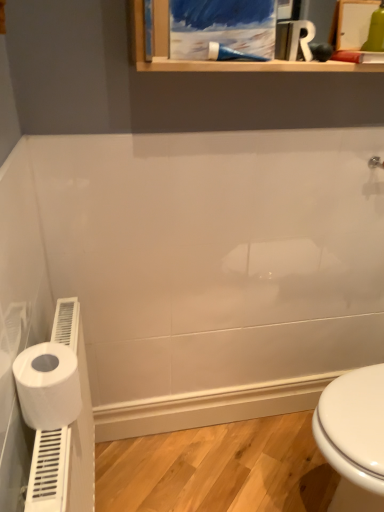
This screenshot has width=384, height=512. What do you see at coordinates (72, 424) in the screenshot?
I see `white plastic toilet paper holder at lower left` at bounding box center [72, 424].

What do you see at coordinates (230, 54) in the screenshot?
I see `blue plastic shower at upper center` at bounding box center [230, 54].

I want to click on white matte toilet paper at left, so click(x=48, y=385).

Is white plastic toilet paper holder at lower left with white matte toilet paper at left?

No, white plastic toilet paper holder at lower left is not making contact with white matte toilet paper at left.

Between white plastic toilet paper holder at lower left and white matte toilet paper at left, which one is positioned in front?

white plastic toilet paper holder at lower left is in front.

Can you confirm if white plastic toilet paper holder at lower left is wider than white matte toilet paper at left?

No, white plastic toilet paper holder at lower left is not wider than white matte toilet paper at left.

The width and height of the screenshot is (384, 512). I want to click on water heater below the white matte toilet paper at left (from the image's perspective), so click(x=72, y=424).

The height and width of the screenshot is (512, 384). In order to click on shower to the right of white matte toilet paper at left in this screenshot , I will do `click(230, 54)`.

In terms of height, does white matte toilet paper at left look taller or shorter compared to blue plastic shower at upper center?

Clearly, white matte toilet paper at left is taller compared to blue plastic shower at upper center.

From the image's perspective, which one is positioned higher, white matte toilet paper at left or blue plastic shower at upper center?

blue plastic shower at upper center appears higher in the image.

Can you confirm if white matte toilet paper at left is smaller than blue plastic shower at upper center?

Actually, white matte toilet paper at left might be larger than blue plastic shower at upper center.

Considering the sizes of blue plastic shower at upper center and white plastic toilet paper holder at lower left in the image, is blue plastic shower at upper center taller or shorter than white plastic toilet paper holder at lower left?

In the image, blue plastic shower at upper center appears to be shorter than white plastic toilet paper holder at lower left.

Does blue plastic shower at upper center appear on the left side of white plastic toilet paper holder at lower left?

Incorrect, blue plastic shower at upper center is not on the left side of white plastic toilet paper holder at lower left.

Are blue plastic shower at upper center and white plastic toilet paper holder at lower left beside each other?

There is a gap between blue plastic shower at upper center and white plastic toilet paper holder at lower left.

Between point (255, 58) and point (81, 322), which one is positioned in front?

The point (255, 58) is closer to the camera.

Considering the relative sizes of white matte toilet paper at left and white plastic toilet paper holder at lower left in the image provided, is white matte toilet paper at left taller than white plastic toilet paper holder at lower left?

Incorrect, the height of white matte toilet paper at left is not larger of that of white plastic toilet paper holder at lower left.

Considering the positions of objects white matte toilet paper at left and white plastic toilet paper holder at lower left in the image provided, who is behind, white matte toilet paper at left or white plastic toilet paper holder at lower left?

white matte toilet paper at left is further away from the camera.

Is point (38, 346) behind point (80, 477)?

That is False.

Is white matte toilet paper at left inside the boundaries of white plastic toilet paper holder at lower left, or outside?

white matte toilet paper at left is spatially situated outside white plastic toilet paper holder at lower left.

From the image's perspective, is blue plastic shower at upper center below white matte toilet paper at left?

Actually, blue plastic shower at upper center appears above white matte toilet paper at left in the image.

Is blue plastic shower at upper center situated inside white matte toilet paper at left or outside?

blue plastic shower at upper center exists outside the volume of white matte toilet paper at left.

Consider the image. Which object is wider, blue plastic shower at upper center or white matte toilet paper at left?

white matte toilet paper at left.

Which of these two, blue plastic shower at upper center or white matte toilet paper at left, stands shorter?

blue plastic shower at upper center is shorter.

Is the position of white plastic toilet paper holder at lower left more distant than that of blue plastic shower at upper center?

That is False.

Does white plastic toilet paper holder at lower left have a larger size compared to blue plastic shower at upper center?

Yes, white plastic toilet paper holder at lower left is bigger than blue plastic shower at upper center.

From the image's perspective, is white plastic toilet paper holder at lower left located above or below blue plastic shower at upper center?

white plastic toilet paper holder at lower left is below blue plastic shower at upper center.

What are the coordinates of `water heater below the white matte toilet paper at left (from the image's perspective)` in the screenshot? It's located at (72, 424).

In order to click on toilet paper lying on the left of blue plastic shower at upper center in this screenshot , I will do `click(48, 385)`.

Looking at this image, when comparing their distances from white plastic toilet paper holder at lower left, does blue plastic shower at upper center or white matte toilet paper at left seem further?

The object further to white plastic toilet paper holder at lower left is blue plastic shower at upper center.

Considering their positions, is blue plastic shower at upper center positioned further to white matte toilet paper at left than white plastic toilet paper holder at lower left?

blue plastic shower at upper center is further to white matte toilet paper at left.

Estimate the real-world distances between objects in this image. Which object is closer to white matte toilet paper at left, white plastic toilet paper holder at lower left or blue plastic shower at upper center?

The object closer to white matte toilet paper at left is white plastic toilet paper holder at lower left.

From the image, which object appears to be farther from blue plastic shower at upper center, white plastic toilet paper holder at lower left or white matte toilet paper at left?

white plastic toilet paper holder at lower left is further to blue plastic shower at upper center.

Based on the photo, looking at the image, which one is located further to blue plastic shower at upper center, white matte toilet paper at left or white plastic toilet paper holder at lower left?

Based on the image, white plastic toilet paper holder at lower left appears to be further to blue plastic shower at upper center.

From the image, which object appears to be nearer to white plastic toilet paper holder at lower left, white matte toilet paper at left or blue plastic shower at upper center?

Based on the image, white matte toilet paper at left appears to be nearer to white plastic toilet paper holder at lower left.

You are a GUI agent. You are given a task and a screenshot of the screen. Output one action in this format:
    pyautogui.click(x=<x>, y=<y>)
    Task: Click on the toilet paper between blue plastic shower at upper center and white plastic toilet paper holder at lower left in the up-down direction
    
    Given the screenshot: What is the action you would take?
    pyautogui.click(x=48, y=385)